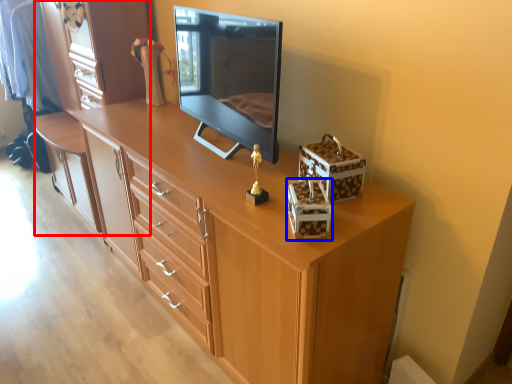
Question: Which object appears farthest to the camera in this image, dresser (highlighted by a red box) or storage box (highlighted by a blue box)?

Choices:
 (A) dresser
 (B) storage box

Answer: (A)